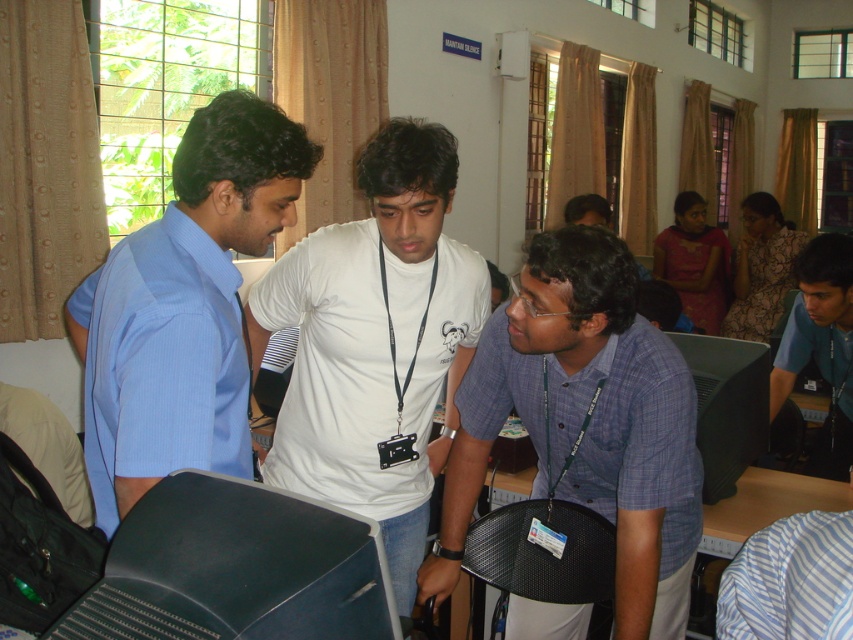
Question: Which object appears farthest from the camera in this image?

Choices:
 (A) light blue shirt at left
 (B) matte pink saree at upper right

Answer: (B)

Question: Which point appears closest to the camera in this image?

Choices:
 (A) [x=807, y=305]
 (B) [x=753, y=401]

Answer: (B)

Question: Where is blue shirt at center located in relation to printed fabric dress at upper right in the image?

Choices:
 (A) below
 (B) above

Answer: (A)

Question: Which point appears closest to the camera in this image?

Choices:
 (A) (219, 492)
 (B) (726, 253)

Answer: (A)

Question: Can you confirm if light blue shirt at left is bigger than printed fabric dress at upper right?

Choices:
 (A) yes
 (B) no

Answer: (B)

Question: Is light blue shirt at left wider than printed fabric dress at upper right?

Choices:
 (A) no
 (B) yes

Answer: (A)